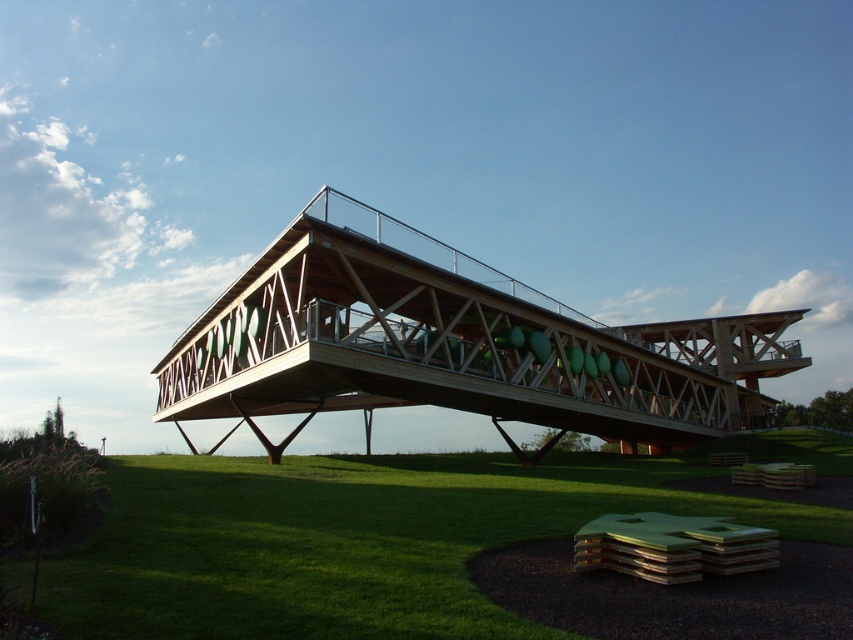
Consider the image. Can you confirm if green grass at lower center is bigger than wooden bridge at center?

No, green grass at lower center is not bigger than wooden bridge at center.

Does green grass at lower center have a lesser width compared to wooden bridge at center?

Indeed, green grass at lower center has a lesser width compared to wooden bridge at center.

Between point (45, 573) and point (279, 381), which one is positioned behind?

The point (279, 381) is behind.

Find the location of a particular element. This screenshot has width=853, height=640. green grass at lower center is located at coordinates (368, 536).